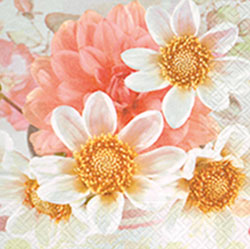
Where is `pink flower on tablecloth`? This screenshot has width=250, height=249. pink flower on tablecloth is located at coordinates (4, 59).